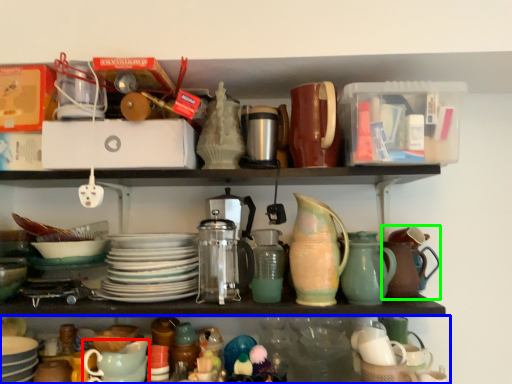
Question: Which is farther away from tableware (highlighted by a red box)? shelf (highlighted by a blue box) or tea pot (highlighted by a green box)?

Choices:
 (A) shelf
 (B) tea pot

Answer: (B)